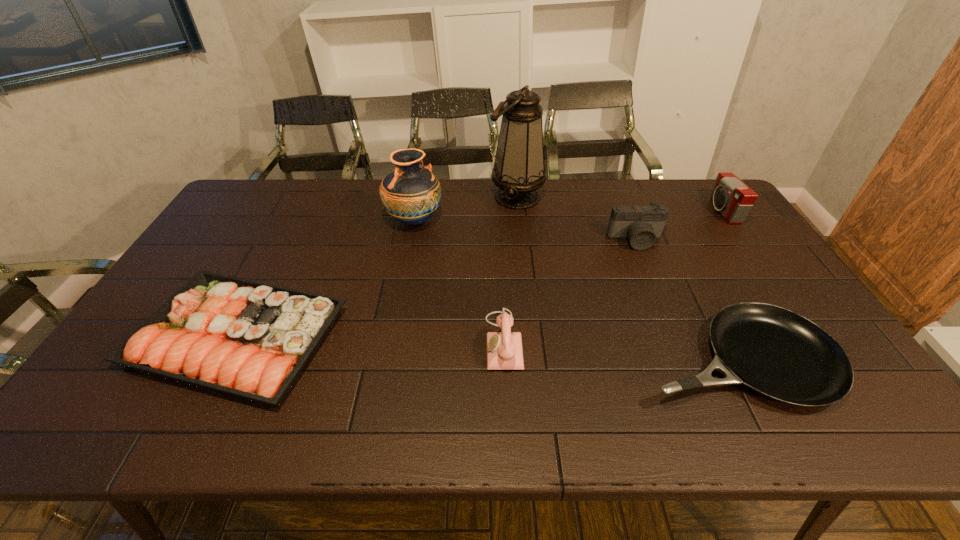
Where is `vacant space situated on the front-facing side of the right camera`? Image resolution: width=960 pixels, height=540 pixels. vacant space situated on the front-facing side of the right camera is located at coordinates (627, 211).

Where is `free space located 0.390m on the front-facing side of the right camera`? This screenshot has height=540, width=960. free space located 0.390m on the front-facing side of the right camera is located at coordinates (601, 211).

Image resolution: width=960 pixels, height=540 pixels. In order to click on vacant space situated 0.180m on the front-facing side of the right camera in this screenshot , I will do `click(661, 211)`.

Locate an element on the screen. The width and height of the screenshot is (960, 540). vacant space located 0.250m at the lens of the nearer camera is located at coordinates (663, 309).

At what (x,y) coordinates should I click in order to perform the action: click on blank space located 0.190m on the dial of the telephone. Please return your answer as a coordinate pair (x, y). Looking at the image, I should click on [411, 341].

Where is `free point located 0.140m on the dial of the telephone`? free point located 0.140m on the dial of the telephone is located at coordinates (430, 341).

Find the location of a particular element. This screenshot has height=540, width=960. free spot located 0.180m on the dial of the telephone is located at coordinates (415, 341).

Find the location of a particular element. The width and height of the screenshot is (960, 540). blank space located 0.160m on the left of the pan is located at coordinates (573, 359).

Locate an element on the screen. This screenshot has height=540, width=960. vacant space located 0.260m on the right of the leftmost object is located at coordinates (443, 338).

This screenshot has height=540, width=960. I want to click on oil lamp located in the far edge section of the desktop, so click(x=518, y=171).